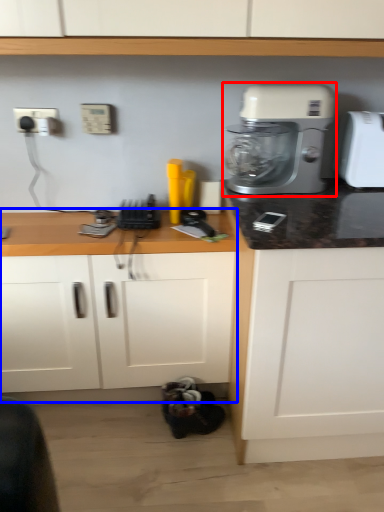
Question: Which object appears closest to the camera in this image, mixer (highlighted by a red box) or counter (highlighted by a blue box)?

Choices:
 (A) mixer
 (B) counter

Answer: (A)